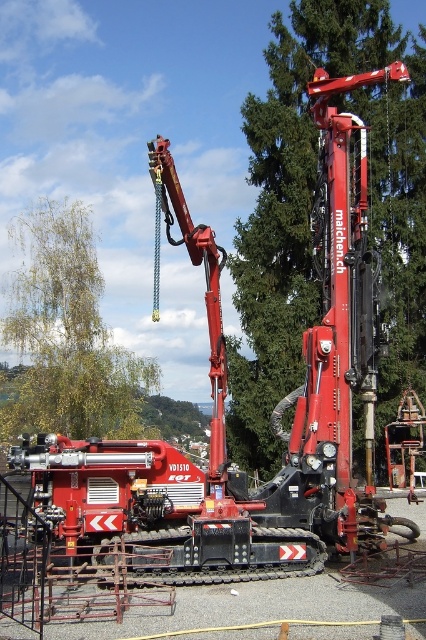
Question: Which point is closer to the camera?

Choices:
 (A) green leafy tree at upper left
 (B) green leafy tree at center

Answer: (B)

Question: Is green leafy tree at center above green leafy tree at upper left?

Choices:
 (A) no
 (B) yes

Answer: (B)

Question: Is green leafy tree at center below green leafy tree at upper left?

Choices:
 (A) yes
 (B) no

Answer: (B)

Question: Which point is farther from the camera taking this photo?

Choices:
 (A) (17, 403)
 (B) (259, 356)

Answer: (A)

Question: Which object appears closest to the camera in this image?

Choices:
 (A) green leafy tree at center
 (B) green leafy tree at upper left

Answer: (A)

Question: Is green leafy tree at center positioned before green leafy tree at upper left?

Choices:
 (A) no
 (B) yes

Answer: (B)